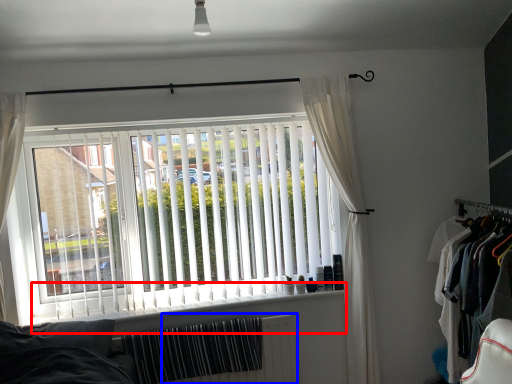
Question: Among these objects, which one is nearest to the camera, window sill (highlighted by a red box) or radiator (highlighted by a blue box)?

Choices:
 (A) window sill
 (B) radiator

Answer: (A)